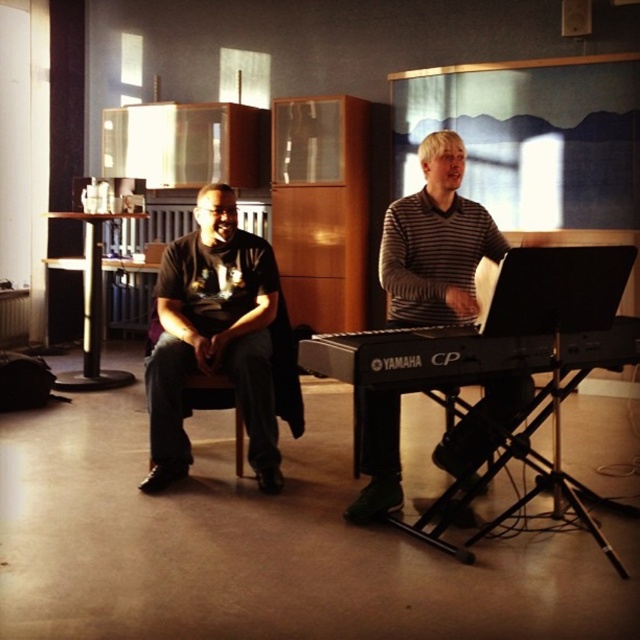
Question: Which point is farther to the camera?

Choices:
 (A) matte black shirt at left
 (B) striped sweater at center

Answer: (A)

Question: Which point is farther from the camera taking this photo?

Choices:
 (A) (355, 369)
 (B) (160, 433)

Answer: (B)

Question: Is matte black shirt at left closer to the viewer compared to striped sweater at center?

Choices:
 (A) no
 (B) yes

Answer: (A)

Question: Which point is closer to the camera taking this photo?

Choices:
 (A) (472, 332)
 (B) (262, 444)

Answer: (A)

Question: From the image, what is the correct spatial relationship of striped sweater at center in relation to black matte keyboard at center?

Choices:
 (A) below
 (B) above

Answer: (B)

Question: Is matte black shirt at left smaller than black matte keyboard at center?

Choices:
 (A) yes
 (B) no

Answer: (B)